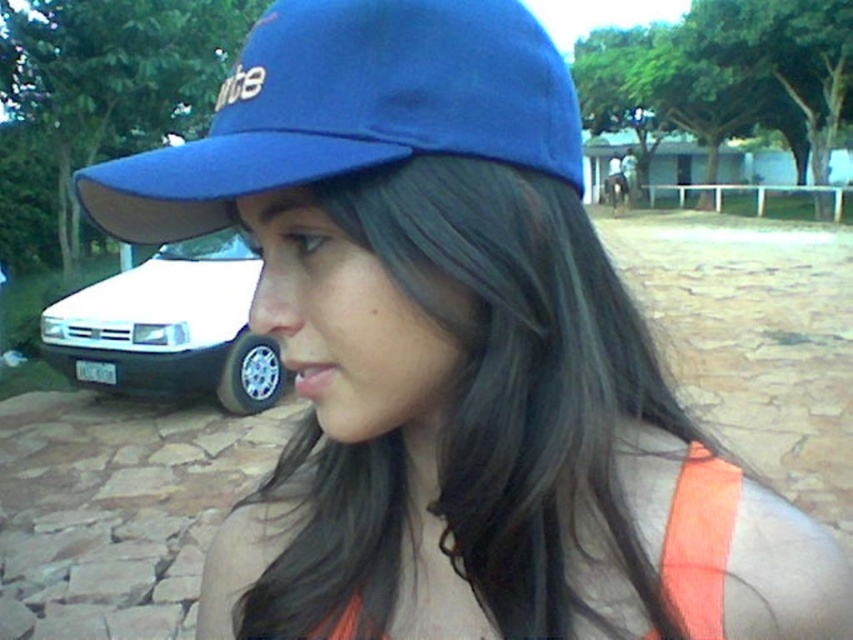
Question: Among these points, which one is nearest to the camera?

Choices:
 (A) (616, 179)
 (B) (671, 566)
 (C) (622, 182)
 (D) (143, 328)

Answer: (B)

Question: Is blue fabric baseball cap at upper left to the right of orange fabric safety vest at lower right from the viewer's perspective?

Choices:
 (A) yes
 (B) no

Answer: (B)

Question: Estimate the real-world distances between objects in this image. Which object is closer to the orange fabric construction vest at center?

Choices:
 (A) blue fabric baseball cap at upper left
 (B) orange fabric safety vest at lower right
 (C) matte blue cap at upper center

Answer: (C)

Question: Is orange fabric safety vest at lower right positioned in front of matte blue cap at upper center?

Choices:
 (A) no
 (B) yes

Answer: (B)

Question: Which object is the closest to the blue fabric baseball cap at upper left?

Choices:
 (A) orange fabric safety vest at lower right
 (B) orange fabric construction vest at center

Answer: (A)

Question: Can you confirm if blue fabric baseball cap at upper left is smaller than white glossy car at left?

Choices:
 (A) no
 (B) yes

Answer: (B)